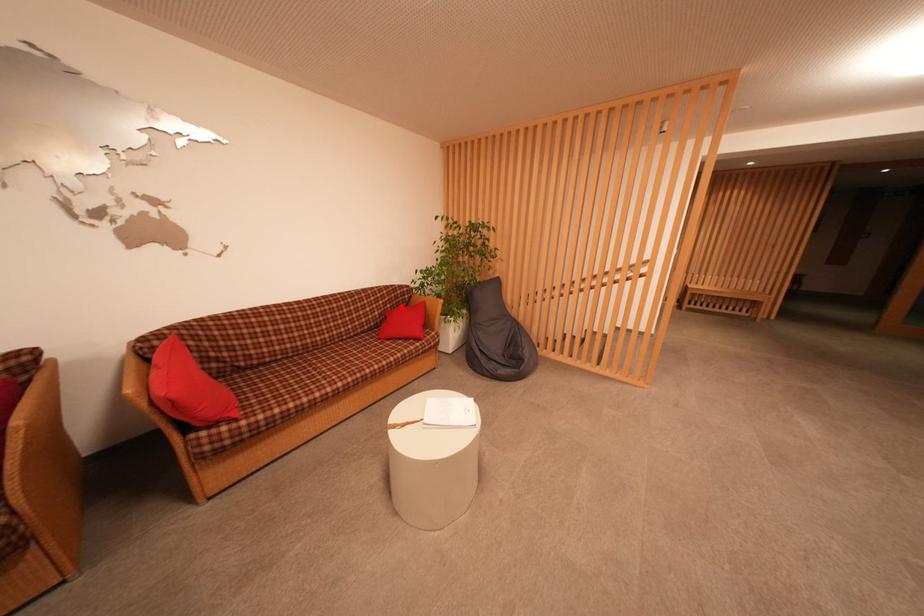
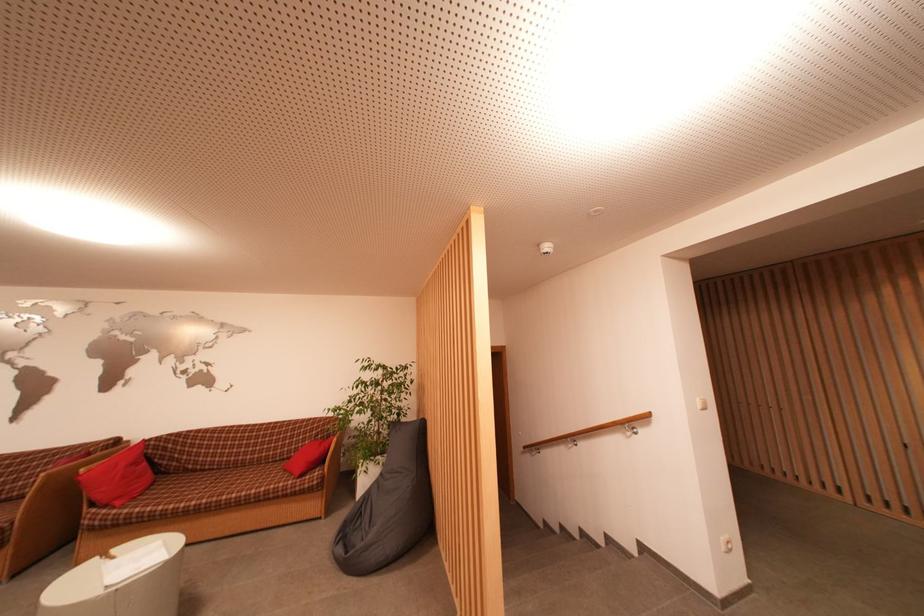
Question: I am providing you with two images of the same scene from different viewpoints. A red point is shown in image1. For the corresponding object point in image2, is it positioned nearer or farther from the camera?

Choices:
 (A) Nearer
 (B) Farther

Answer: (B)